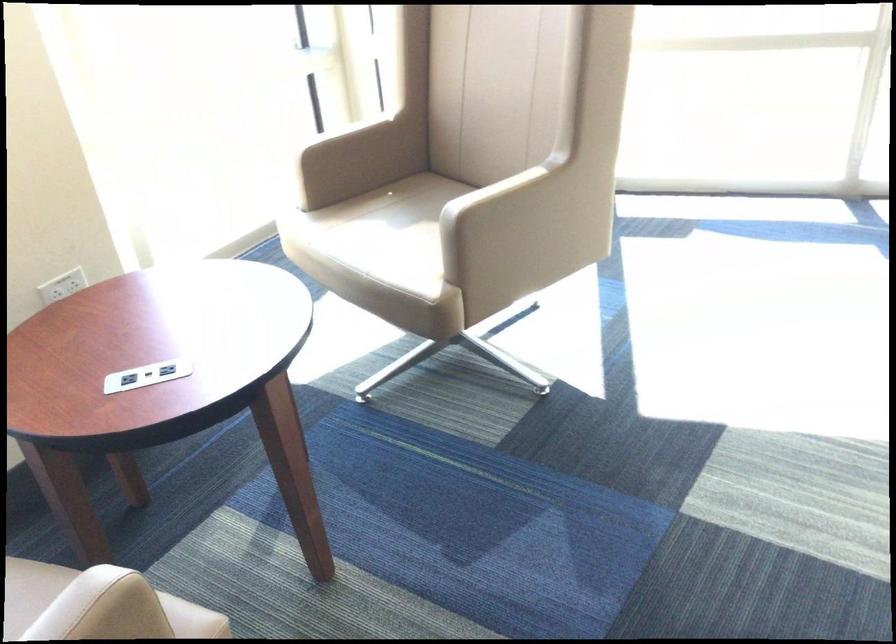
What are the coordinates of `chair armrest` in the screenshot? It's located at (97, 605).